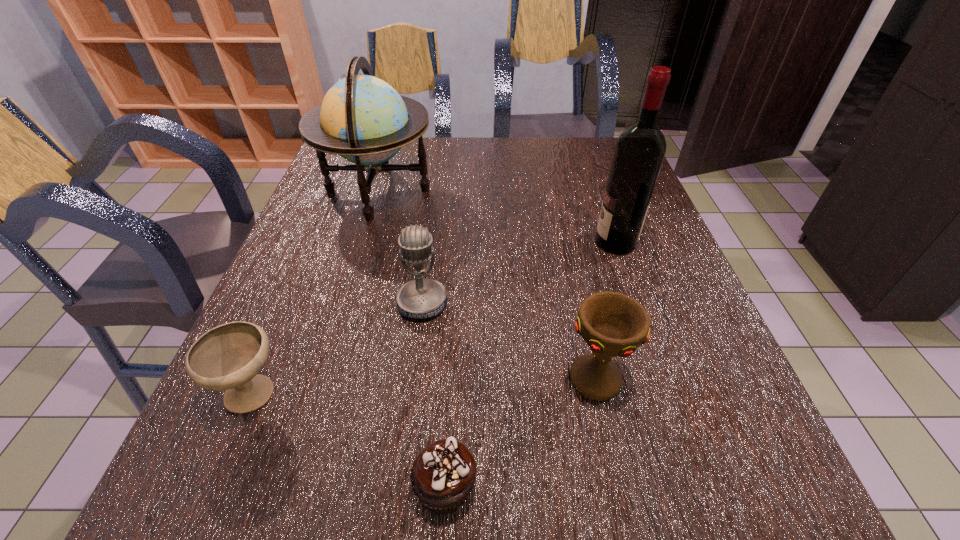
Find the location of a particular element. free space at the near left corner of the desktop is located at coordinates (246, 497).

Identify the location of vacant region at the far right corner of the desktop. Image resolution: width=960 pixels, height=540 pixels. (603, 147).

The image size is (960, 540). I want to click on vacant space that is in between the third tallest object and the second farthest object, so click(x=519, y=273).

The image size is (960, 540). Find the location of `vacant space in between the alcohol and the fourth shortest object`. vacant space in between the alcohol and the fourth shortest object is located at coordinates 519,273.

Image resolution: width=960 pixels, height=540 pixels. Find the location of `free point between the globe and the fifth tallest object`. free point between the globe and the fifth tallest object is located at coordinates (316, 292).

Find the location of a particular element. The height and width of the screenshot is (540, 960). free space between the fifth nearest object and the third tallest object is located at coordinates (519, 273).

Where is `free point between the fifth shortest object and the left chalice`? Image resolution: width=960 pixels, height=540 pixels. free point between the fifth shortest object and the left chalice is located at coordinates (316, 292).

Find the location of a particular element. vacant point located between the globe and the alcohol is located at coordinates (496, 217).

This screenshot has height=540, width=960. What are the coordinates of `unoccupied position between the shortest object and the farthest object` in the screenshot? It's located at (411, 339).

This screenshot has height=540, width=960. Identify the location of free space that is in between the nearest object and the left chalice. (349, 441).